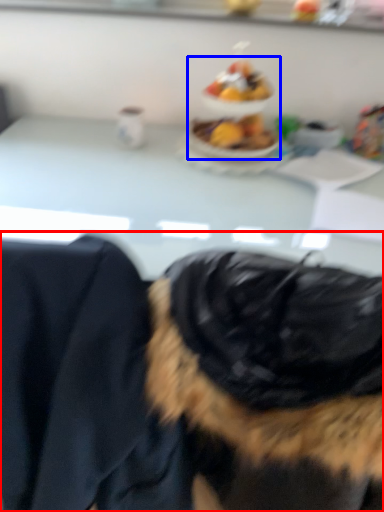
Question: Which object is closer to the camera taking this photo, dog (highlighted by a red box) or food (highlighted by a blue box)?

Choices:
 (A) dog
 (B) food

Answer: (A)